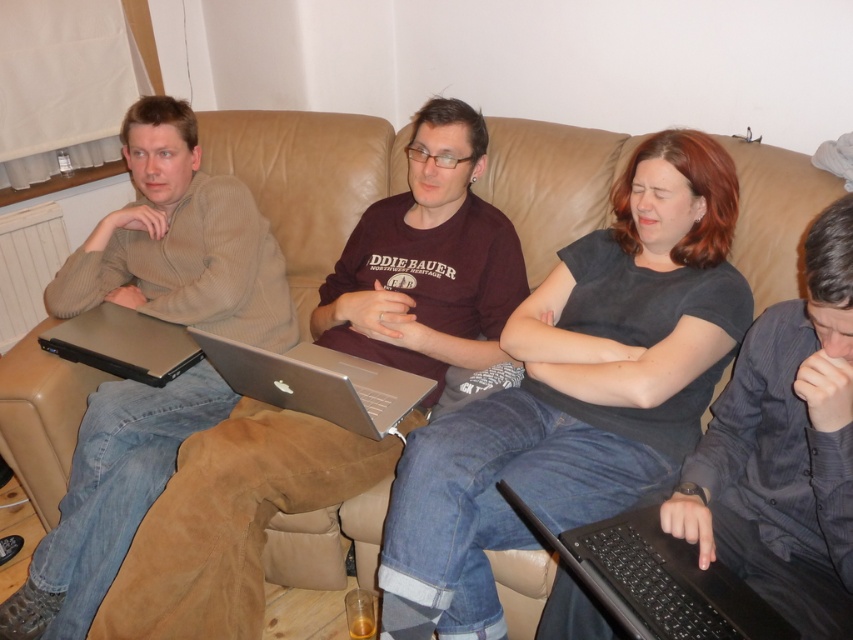
Question: Can you confirm if black plastic laptop at lower right is positioned to the left of silver metallic laptop at left?

Choices:
 (A) no
 (B) yes

Answer: (A)

Question: Does matte brown sweater at left appear on the right side of silver metallic laptop at left?

Choices:
 (A) yes
 (B) no

Answer: (A)

Question: Which point is farther from the camera taking this photo?

Choices:
 (A) (442, 621)
 (B) (363, 625)
 (C) (677, 584)

Answer: (B)

Question: Which point is farther from the camera taking this photo?

Choices:
 (A) (172, 342)
 (B) (521, 525)
 (C) (86, 540)
 (D) (363, 595)

Answer: (A)

Question: Among these objects, which one is nearest to the camera?

Choices:
 (A) black plastic laptop at lower right
 (B) silver metallic laptop at center
 (C) dark gray shirt at center
 (D) dark gray matte shirt at center

Answer: (C)

Question: Can you confirm if dark gray matte shirt at center is positioned to the right of translucent plastic cup at lower center?

Choices:
 (A) yes
 (B) no

Answer: (A)